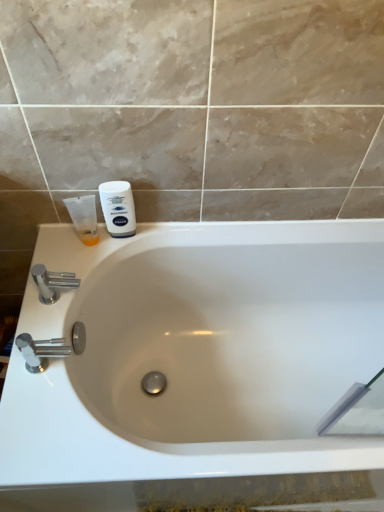
Identify the location of free space in front of translucent orange tube at left, which appears as the 1th shaving cream when viewed from the left. Image resolution: width=384 pixels, height=512 pixels. (74, 272).